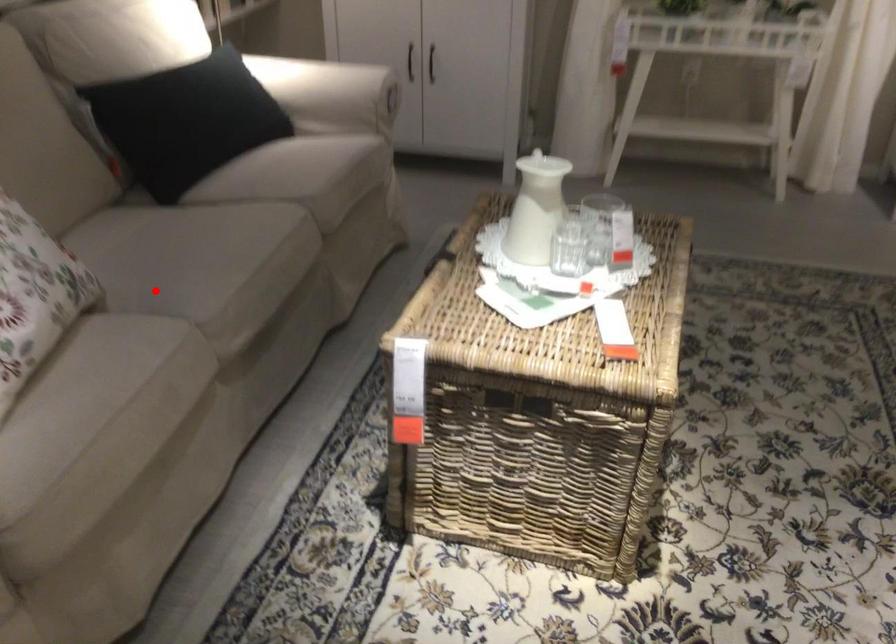
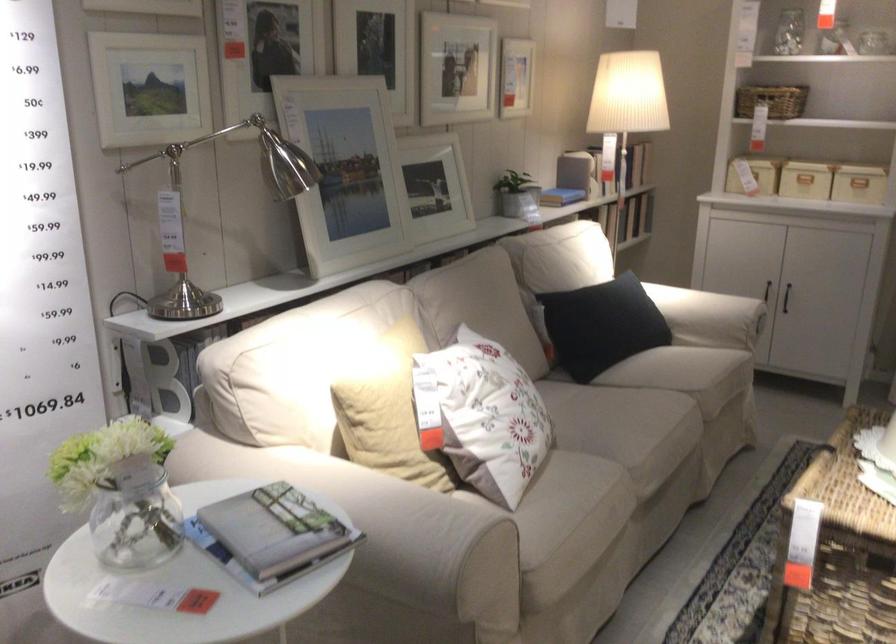
The point at the highlighted location is marked in the first image. Where is the corresponding point in the second image?

(596, 442)